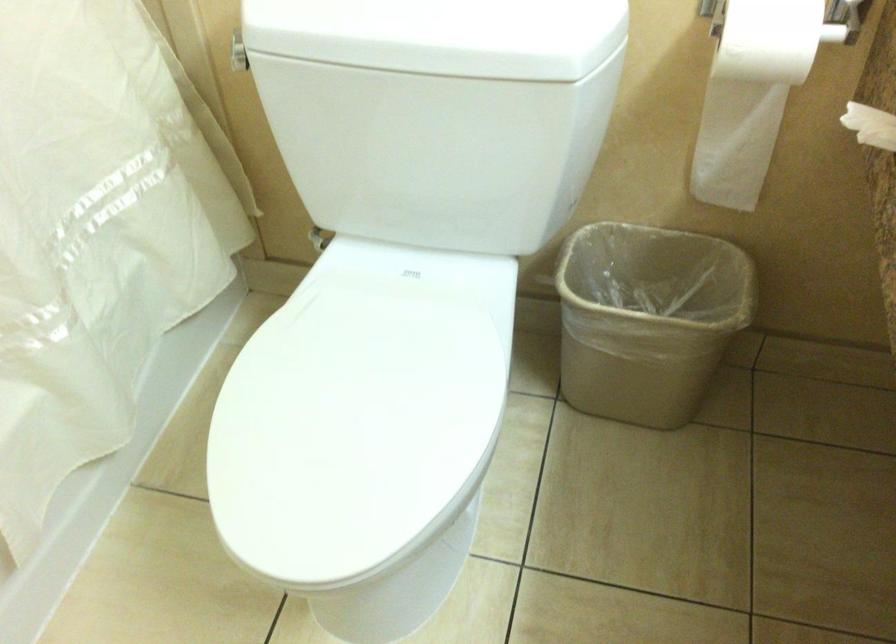
Image resolution: width=896 pixels, height=644 pixels. Find the location of `toilet flush handle`. toilet flush handle is located at coordinates 237,53.